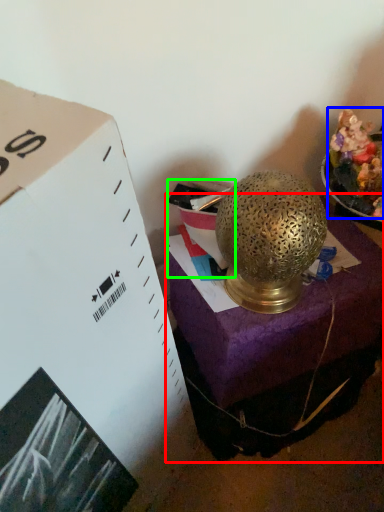
Question: Estimate the real-world distances between objects in this image. Which object is farther from furniture (highlighted by a red box), food (highlighted by a blue box) or box (highlighted by a green box)?

Choices:
 (A) food
 (B) box

Answer: (A)